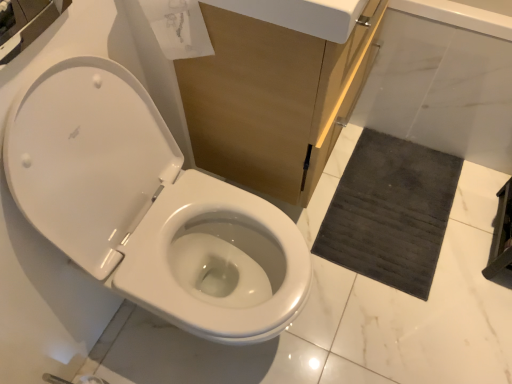
Question: Considering the relative sizes of white marble bath at lower right and transparent paper at upper center in the image provided, is white marble bath at lower right wider than transparent paper at upper center?

Choices:
 (A) no
 (B) yes

Answer: (A)

Question: Is transparent paper at upper center completely or partially inside white marble bath at lower right?

Choices:
 (A) no
 (B) yes

Answer: (A)

Question: From the image's perspective, is white marble bath at lower right on top of transparent paper at upper center?

Choices:
 (A) no
 (B) yes

Answer: (A)

Question: Is white marble bath at lower right thinner than transparent paper at upper center?

Choices:
 (A) no
 (B) yes

Answer: (B)

Question: Is white marble bath at lower right closer to the viewer compared to transparent paper at upper center?

Choices:
 (A) yes
 (B) no

Answer: (B)

Question: In terms of width, does matte wood cabinet at center look wider or thinner when compared to white glossy toilet at left?

Choices:
 (A) wide
 (B) thin

Answer: (B)

Question: Considering their positions, is matte wood cabinet at center located in front of or behind white glossy toilet at left?

Choices:
 (A) front
 (B) behind

Answer: (B)

Question: Is point (251, 91) closer or farther from the camera than point (131, 228)?

Choices:
 (A) closer
 (B) farther

Answer: (A)

Question: Choose the correct answer: Is matte wood cabinet at center inside white glossy toilet at left or outside it?

Choices:
 (A) outside
 (B) inside

Answer: (A)

Question: From a real-world perspective, is transparent paper at upper center physically located above or below dark gray textured bath mat at lower right?

Choices:
 (A) below
 (B) above

Answer: (B)

Question: Relative to dark gray textured bath mat at lower right, is transparent paper at upper center in front or behind?

Choices:
 (A) front
 (B) behind

Answer: (A)

Question: Considering the positions of transparent paper at upper center and dark gray textured bath mat at lower right in the image, is transparent paper at upper center wider or thinner than dark gray textured bath mat at lower right?

Choices:
 (A) wide
 (B) thin

Answer: (B)

Question: Is transparent paper at upper center situated inside dark gray textured bath mat at lower right or outside?

Choices:
 (A) inside
 (B) outside

Answer: (B)

Question: In terms of width, does dark gray textured bath mat at lower right look wider or thinner when compared to white marble bath at lower right?

Choices:
 (A) wide
 (B) thin

Answer: (A)

Question: Is point (355, 238) closer or farther from the camera than point (460, 74)?

Choices:
 (A) farther
 (B) closer

Answer: (A)